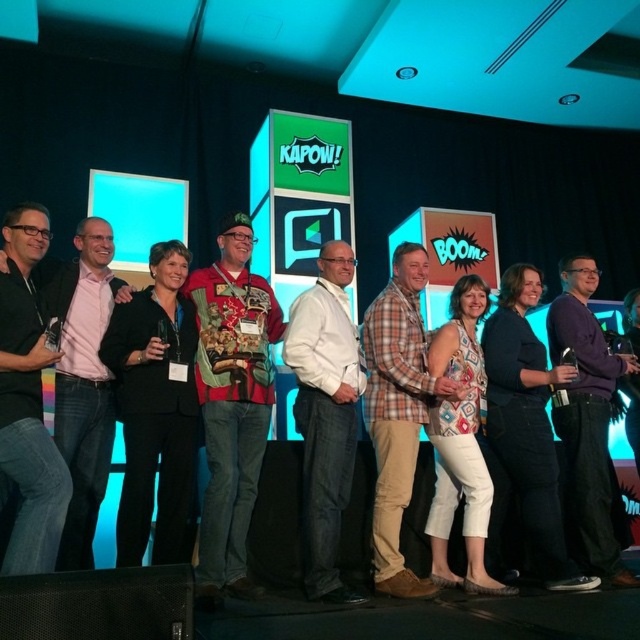
Question: Can you confirm if plaid cotton shirt at center is positioned to the right of black matte suit at left?

Choices:
 (A) no
 (B) yes

Answer: (B)

Question: Which object is the closest to the purple cotton shirt at center?

Choices:
 (A) black matte suit at left
 (B) white matte shirt at center

Answer: (B)

Question: Can you confirm if black matte suit at left is positioned above purple cotton shirt at center?

Choices:
 (A) no
 (B) yes

Answer: (B)

Question: Does white matte shirt at center appear on the left side of plaid cotton shirt at center?

Choices:
 (A) no
 (B) yes

Answer: (B)

Question: Which of the following is the farthest from the observer?

Choices:
 (A) purple cotton shirt at center
 (B) white matte shirt at center
 (C) black matte suit at left
 (D) plaid cotton shirt at center

Answer: (A)

Question: Which of the following is the closest to the observer?

Choices:
 (A) (x=410, y=291)
 (B) (x=332, y=358)

Answer: (B)